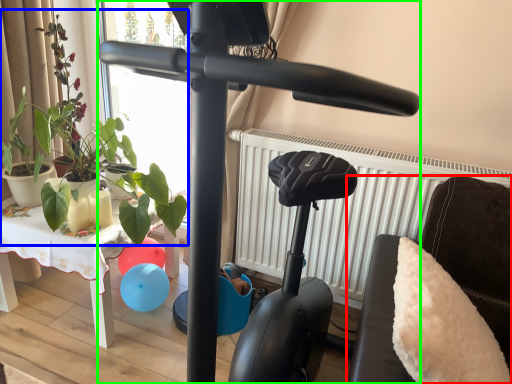
Question: Which object is positioned farthest from furniture (highlighted by a red box)? Select from plant (highlighted by a blue box) and stationary bicycle (highlighted by a green box).

Choices:
 (A) plant
 (B) stationary bicycle

Answer: (A)